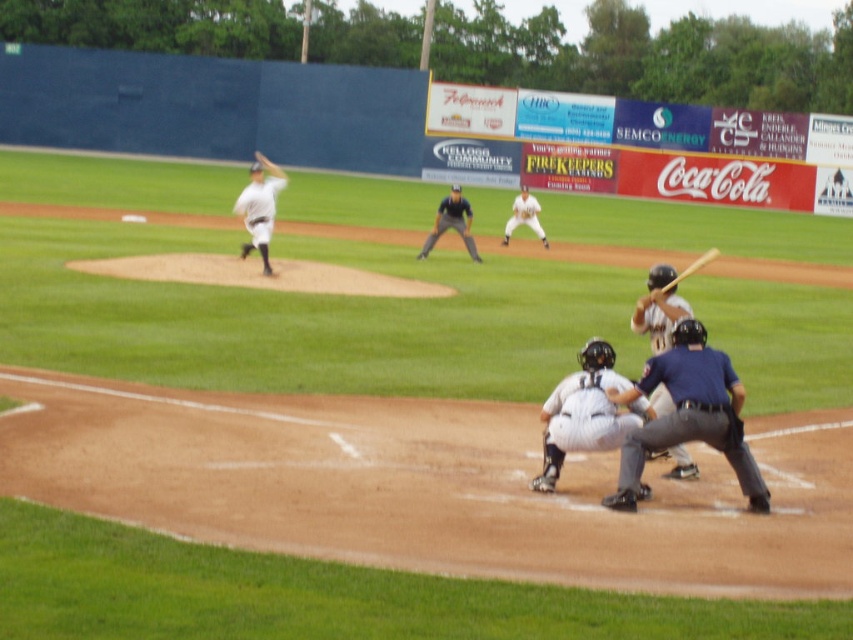
You are a spectator at the baseball game and want to take a photo of the white matte bat at center and the white matte baseball player at center. Which object should you focus on first if you want to capture both in a single frame without moving the camera?

The white matte bat at center is to the right of the white matte baseball player at center, so you should focus on the white matte baseball player at center first since it is closer to the left side, allowing both to fit in the frame when positioned properly.

You are a coach observing the baseball game. You notice the white matte bat at center and the dark gray uniform at center. Which object is located to the right of the other?

The white matte bat at center is positioned on the right side of dark gray uniform at center.

You are a coach analyzing the players on the field. You notice the white matte bat at center and the dark gray uniform at center. Which object is smaller in size?

The white matte bat at center is smaller than the dark gray uniform at center.